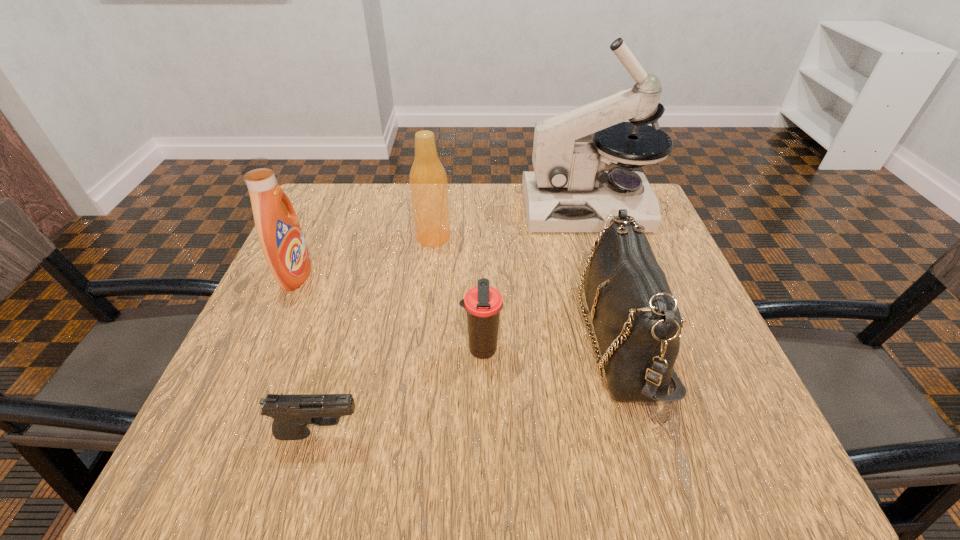
Where is `vacant space located 0.120m at the eyepiece of the tallest object`? This screenshot has height=540, width=960. vacant space located 0.120m at the eyepiece of the tallest object is located at coordinates (480, 207).

Where is `free region located 0.110m on the front-facing side of the leftmost object`? The image size is (960, 540). free region located 0.110m on the front-facing side of the leftmost object is located at coordinates coord(359,275).

At what (x,y) coordinates should I click in order to perform the action: click on vacant point located on the left of the beer bottle. Please return your answer as a coordinate pair (x, y). The image size is (960, 540). Looking at the image, I should click on (359, 238).

Identify the location of free spot located 0.230m at the front of the handbag with chain and zipper. (462, 339).

Locate an element on the screen. The width and height of the screenshot is (960, 540). vacant space located 0.100m at the front of the handbag with chain and zipper is located at coordinates (530, 339).

Where is `vacant region located 0.250m at the front of the handbag with chain and zipper`? Image resolution: width=960 pixels, height=540 pixels. vacant region located 0.250m at the front of the handbag with chain and zipper is located at coordinates (451, 339).

The height and width of the screenshot is (540, 960). In order to click on vacant space located 0.060m on the back of the fourth object from left to right in this screenshot , I will do (x=481, y=313).

I want to click on vacant region located at the barrel of the second object from left to right, so click(426, 433).

The height and width of the screenshot is (540, 960). I want to click on microscope situated at the far edge, so click(x=568, y=191).

The image size is (960, 540). Find the location of `beer bottle that is at the far edge`. beer bottle that is at the far edge is located at coordinates (428, 182).